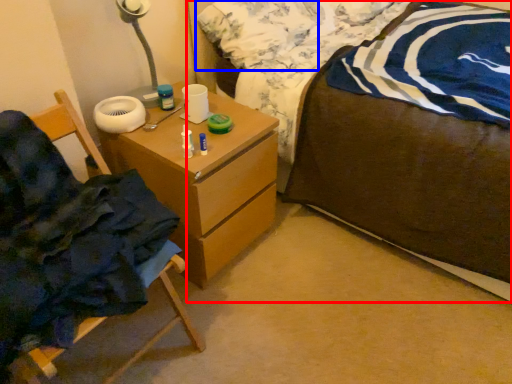
Question: Which object is further to the camera taking this photo, bed (highlighted by a red box) or pillow (highlighted by a blue box)?

Choices:
 (A) bed
 (B) pillow

Answer: (B)